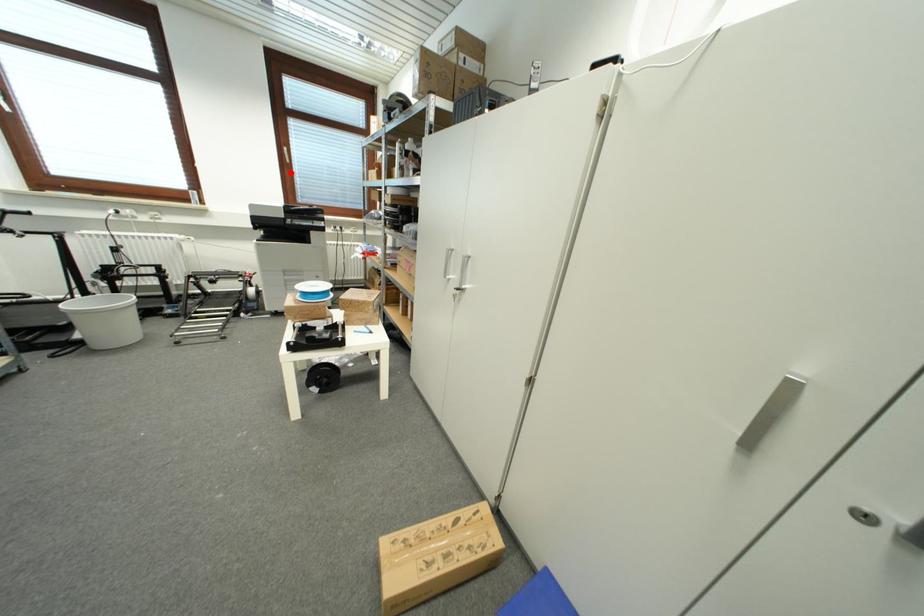
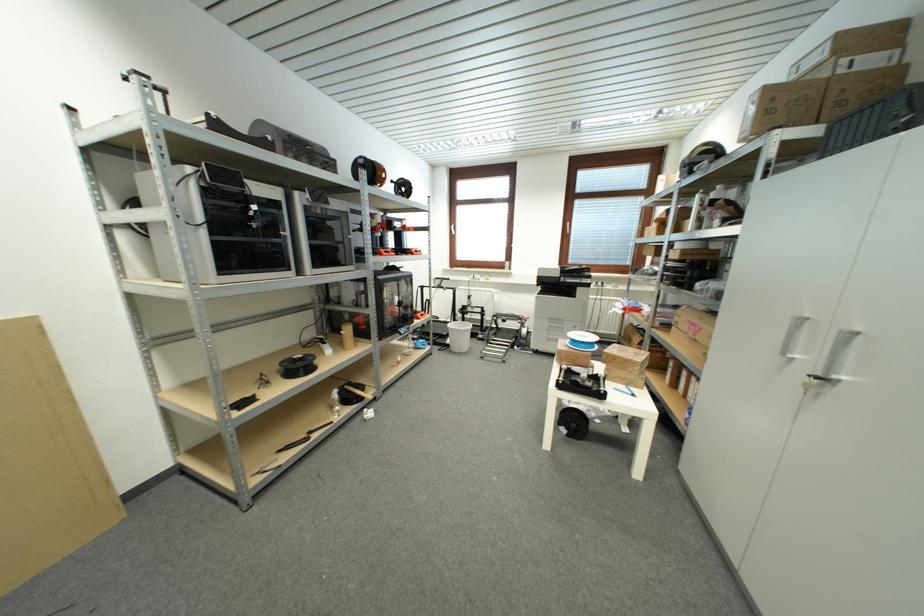
Find the pixel in the second image that matches the highlighted location in the first image.

(569, 241)